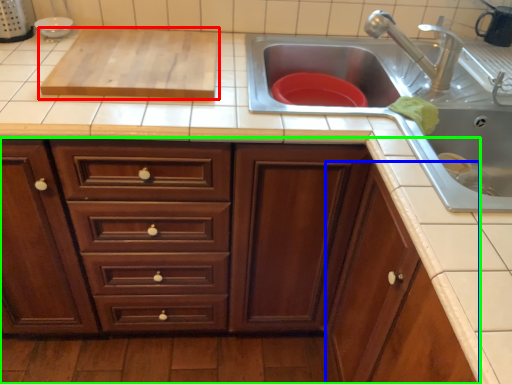
Question: Which object is the closest to the wide (highlighted by a red box)? Choose among these: cabinetry (highlighted by a blue box) or cabinetry (highlighted by a green box).

Choices:
 (A) cabinetry
 (B) cabinetry

Answer: (B)